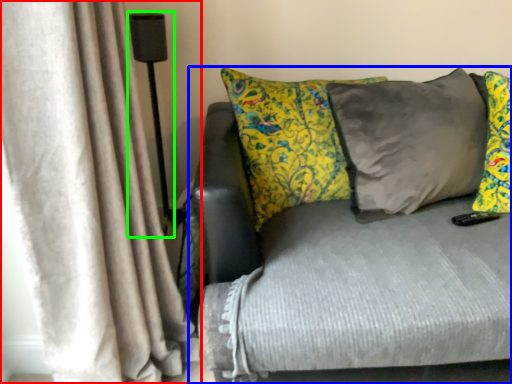
Question: Which object is the closest to the curtain (highlighted by a red box)? Choose among these: studio couch (highlighted by a blue box) or lamp (highlighted by a green box).

Choices:
 (A) studio couch
 (B) lamp

Answer: (A)